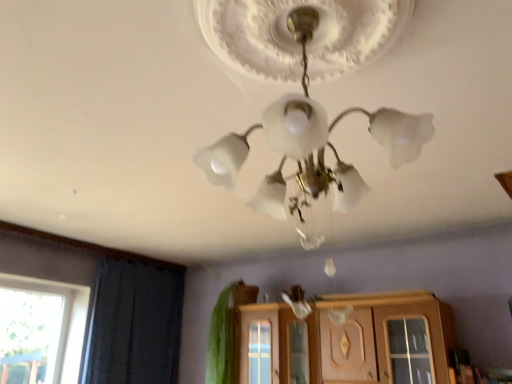
At what (x,y) coordinates should I click in order to perform the action: click on dark blue fabric at left. Please return your answer as a coordinate pair (x, y). This screenshot has width=512, height=384. Looking at the image, I should click on (134, 324).

What is the approximate height of dark blue fabric at left?

dark blue fabric at left is 1.08 meters in height.

What do you see at coordinates (134, 324) in the screenshot? The image size is (512, 384). I see `dark blue fabric at left` at bounding box center [134, 324].

Identify the location of dark blue fabric at left. This screenshot has width=512, height=384. (134, 324).